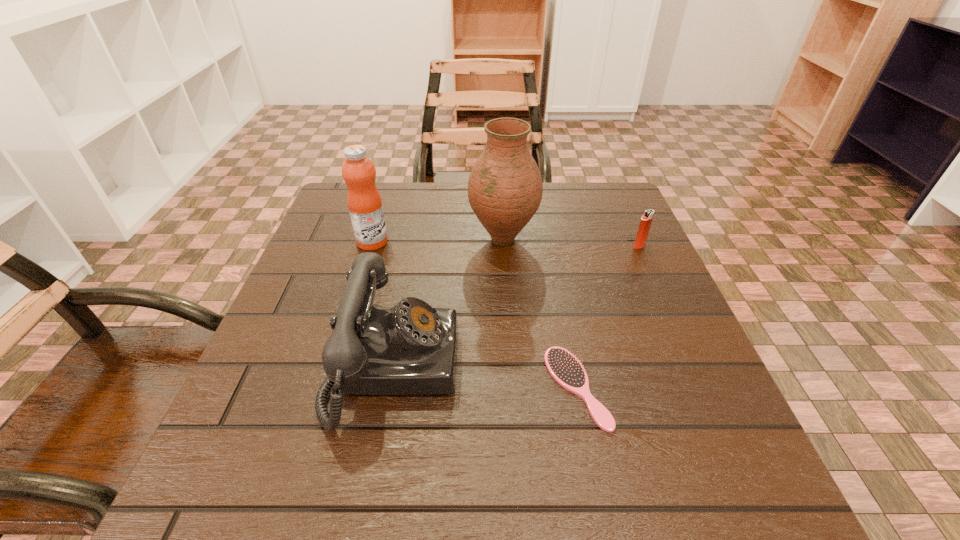
Identify the location of vase. (505, 187).

The image size is (960, 540). I want to click on the fourth shortest object, so click(364, 202).

You are a GUI agent. You are given a task and a screenshot of the screen. Output one action in this format:
    pyautogui.click(x=<x>, y=<y>)
    Task: Click on the third tallest object
    
    Given the screenshot: What is the action you would take?
    pyautogui.click(x=410, y=349)

Locate an element on the screen. The height and width of the screenshot is (540, 960). igniter is located at coordinates (645, 223).

I want to click on the fourth tallest object, so click(x=645, y=223).

Identify the location of hairbrush. This screenshot has height=540, width=960. (564, 367).

Image resolution: width=960 pixels, height=540 pixels. I want to click on free region located on the right of the tallest object, so click(597, 239).

In order to click on free space located 0.140m on the front label of the fruit juice in this screenshot , I will do `click(448, 242)`.

The width and height of the screenshot is (960, 540). Identify the location of free space located 0.380m on the dial of the telephone. (679, 367).

In order to click on blank space located on the front of the igniter in this screenshot , I will do `click(680, 335)`.